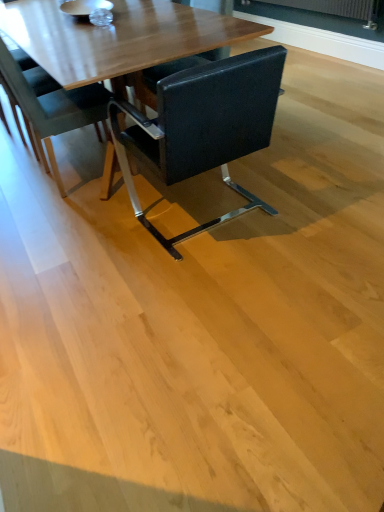
The image size is (384, 512). In order to click on blank area beneath black leather chair at center, arranged as the 2th chair when viewed from the right (from a real-world perspective) in this screenshot , I will do click(77, 179).